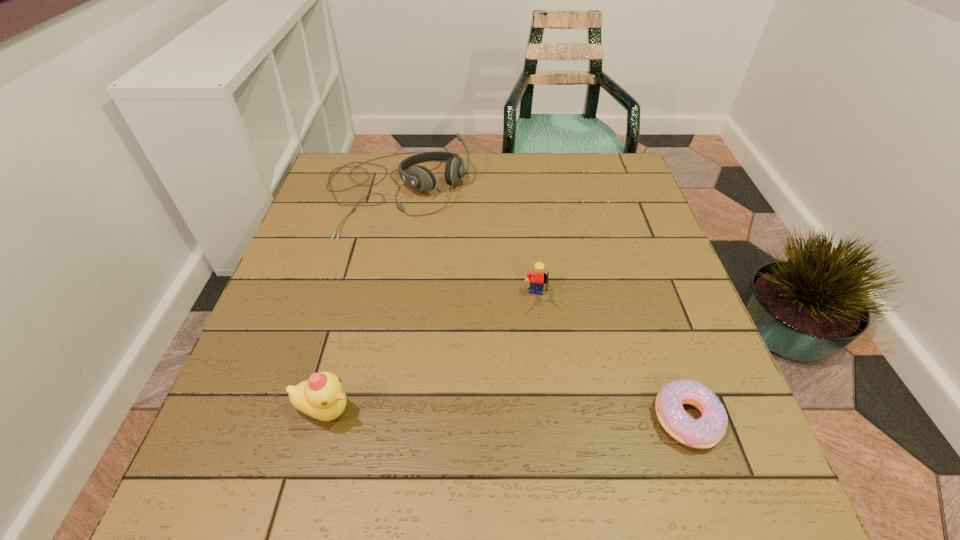
Where is `vacant space located on the front-facing side of the Lego`? vacant space located on the front-facing side of the Lego is located at coordinates (523, 367).

At what (x,y) coordinates should I click in order to perform the action: click on free space located 0.270m on the outer surface of the headset. Please return your answer as a coordinate pair (x, y). Looking at the image, I should click on (450, 315).

The width and height of the screenshot is (960, 540). Find the location of `blank space located on the outer surface of the headset`. blank space located on the outer surface of the headset is located at coordinates (434, 277).

Identify the location of blank space located 0.250m on the outer surface of the headset. The image size is (960, 540). (447, 308).

In order to click on object that is at the far edge in this screenshot , I will do `click(420, 178)`.

At what (x,y) coordinates should I click in order to perform the action: click on duckling positioned at the near edge. Please return your answer as a coordinate pair (x, y). This screenshot has width=960, height=540. Looking at the image, I should click on (321, 396).

Where is `doughnut located at the near edge`? The image size is (960, 540). doughnut located at the near edge is located at coordinates (705, 432).

Find the location of a particular element. duckling positioned at the left edge is located at coordinates (321, 396).

Find the location of a particular element. headset at the left edge is located at coordinates (420, 178).

This screenshot has width=960, height=540. What are the coordinates of `object at the right edge` in the screenshot? It's located at (705, 432).